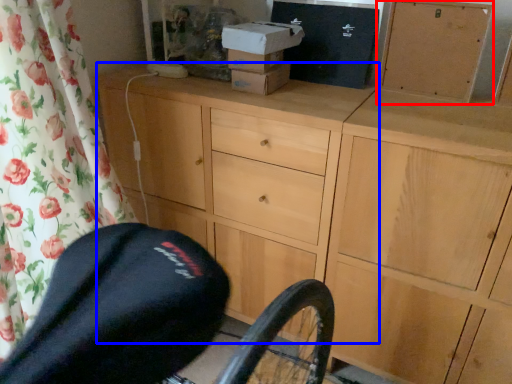
Question: Which object is further to the camera taking this photo, cabinetry (highlighted by a red box) or chest of drawers (highlighted by a blue box)?

Choices:
 (A) cabinetry
 (B) chest of drawers

Answer: (A)